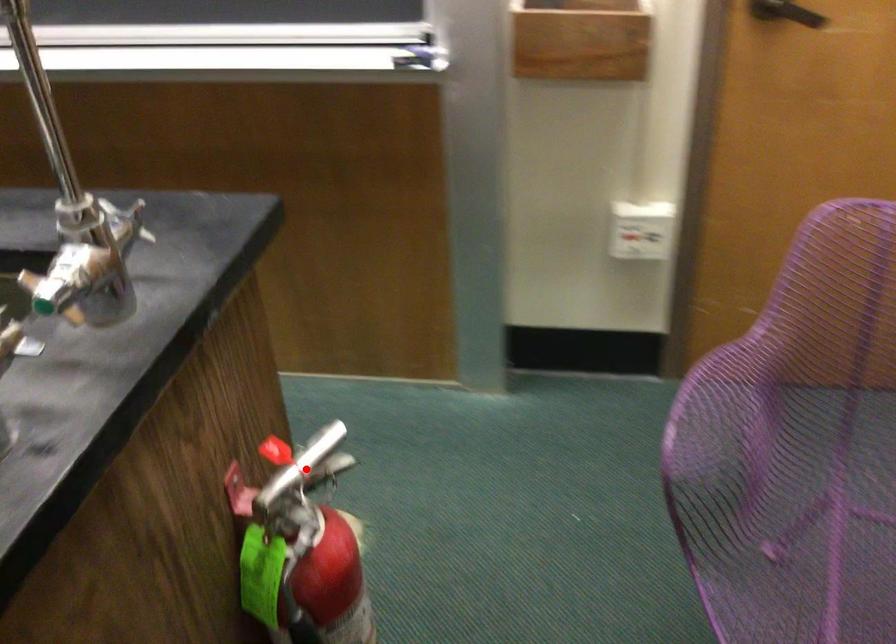
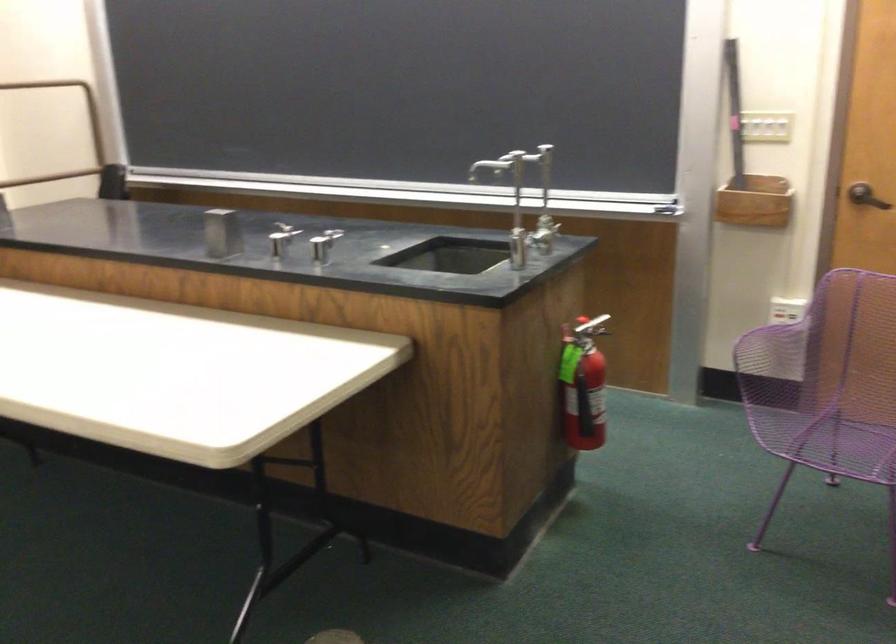
Locate, in the second image, the point that corresponds to the highlighted location in the first image.

(590, 327)